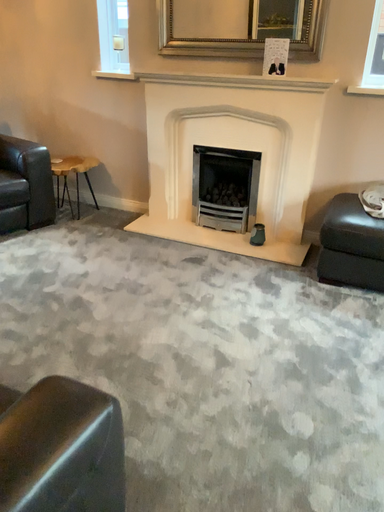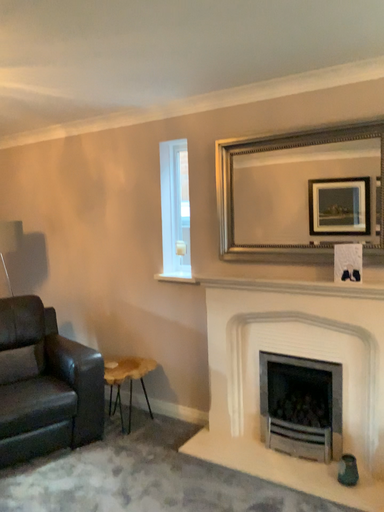
Question: How did the camera likely rotate when shooting the video?

Choices:
 (A) rotated downward
 (B) rotated upward

Answer: (B)